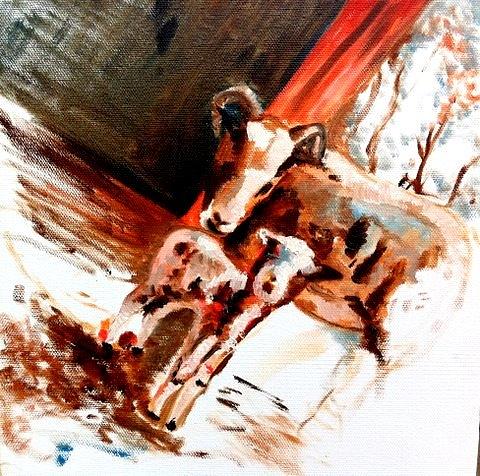
Find the location of a particular element. This screenshot has width=480, height=476. wall is located at coordinates (179, 80).